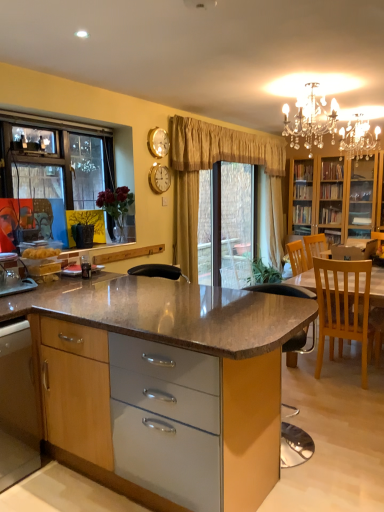
This screenshot has width=384, height=512. In order to click on free space above wooden/textured cabinet at center, positioned as the 2th cabinetry in left-to-right order (from a real-world perspective) in this screenshot , I will do `click(138, 289)`.